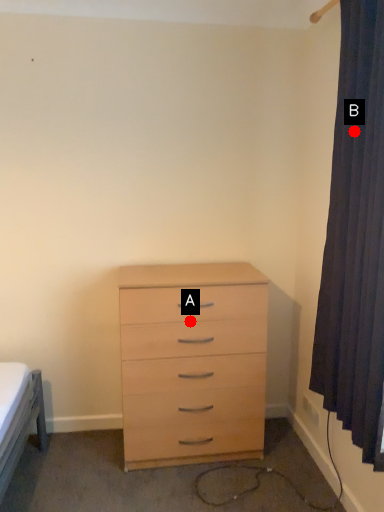
Question: Two points are circled on the image, labeled by A and B beside each circle. Which of the following is the farthest from the observer?

Choices:
 (A) A is further
 (B) B is further

Answer: (A)